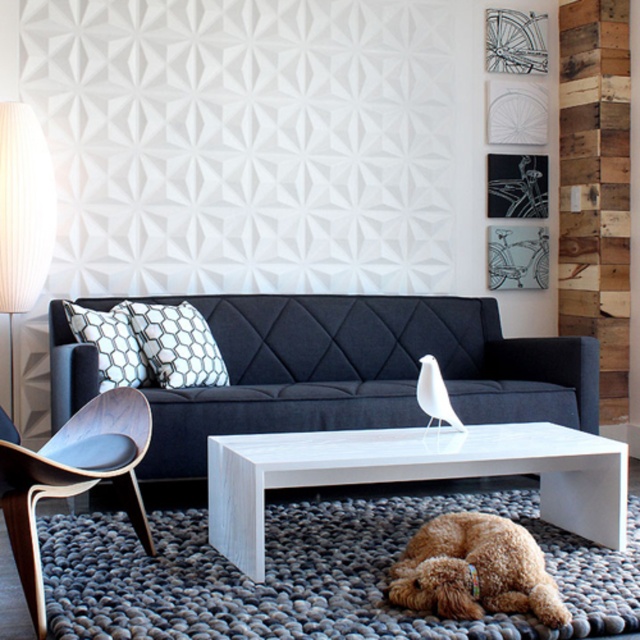
Question: Is wooden armchair at left positioned before white textured pillow at center?

Choices:
 (A) yes
 (B) no

Answer: (A)

Question: Which object appears farthest from the camera in this image?

Choices:
 (A) white textured pillow at center
 (B) white pleated fabric lampshade at left
 (C) white hexagonal pillow at center

Answer: (B)

Question: Estimate the real-world distances between objects in this image. Which object is farther from the white pleated fabric lampshade at left?

Choices:
 (A) wooden armchair at left
 (B) white textured pillow at center
 (C) dark blue fabric couch at center

Answer: (A)

Question: Can you confirm if dark blue fabric couch at center is positioned above white pleated fabric lampshade at left?

Choices:
 (A) no
 (B) yes

Answer: (A)

Question: Which object is positioned farthest from the wooden armchair at left?

Choices:
 (A) brown furry dog at lower center
 (B) white hexagonal pillow at center
 (C) dark blue fabric couch at center
 (D) white textured pillow at center

Answer: (A)

Question: Is dark blue fabric couch at center smaller than white hexagonal pillow at center?

Choices:
 (A) yes
 (B) no

Answer: (B)